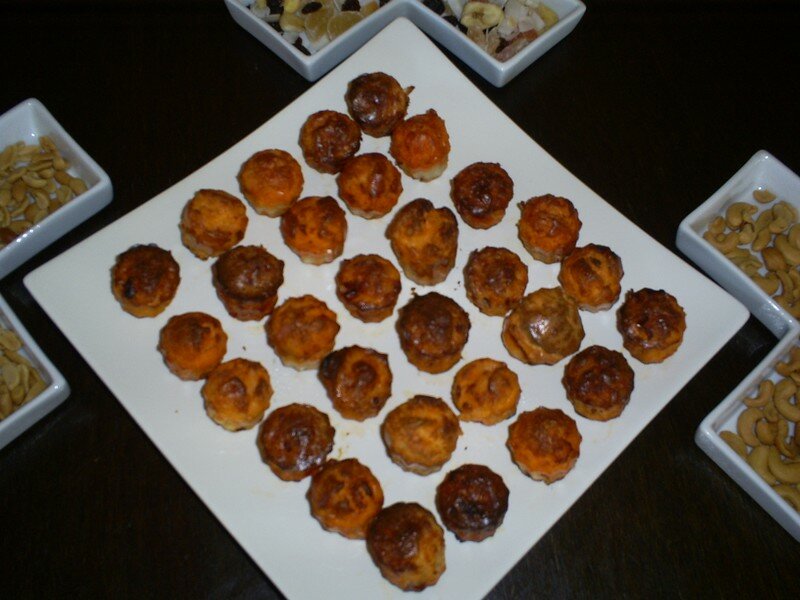
Locate an element on the screen. cooked food is located at coordinates (418, 335).